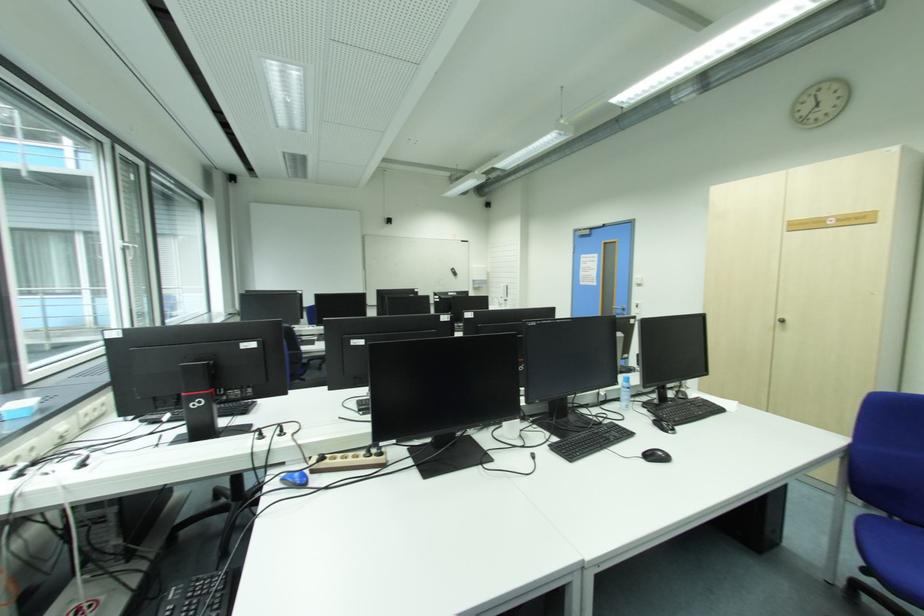
Find the location of a particular element. silver cabinet knob is located at coordinates (781, 321).